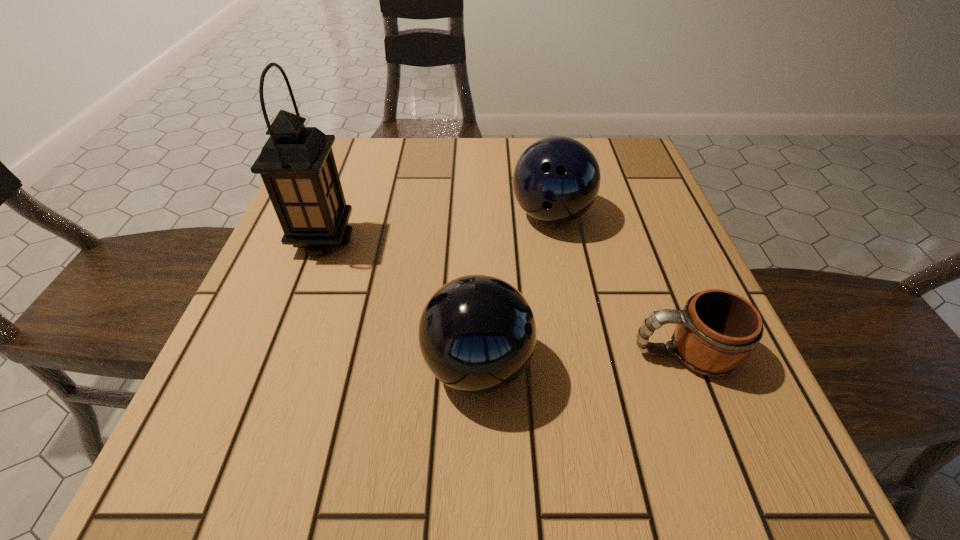
You are a GUI agent. You are given a task and a screenshot of the screen. Output one action in this format:
    pyautogui.click(x=<x>, y=<y>)
    Task: Click on the free location at the right edge of the desktop
    
    Given the screenshot: What is the action you would take?
    pyautogui.click(x=595, y=221)

Find the location of a particular element. This screenshot has width=960, height=540. vacant space at the far left corner of the desktop is located at coordinates (371, 150).

In the image, there is a desktop. At what (x,y) coordinates should I click in order to perform the action: click on free region at the near left corner. Please return your answer as a coordinate pair (x, y). The width and height of the screenshot is (960, 540). Looking at the image, I should click on (218, 456).

You are a GUI agent. You are given a task and a screenshot of the screen. Output one action in this format:
    pyautogui.click(x=<x>, y=<y>)
    Task: Click on the free space at the far right corner
    
    Given the screenshot: What is the action you would take?
    pyautogui.click(x=620, y=181)

The width and height of the screenshot is (960, 540). What are the coordinates of `free space at the near right corner of the desktop` in the screenshot? It's located at (715, 440).

Where is `free space between the tallest object and the farther bowling ball`? Image resolution: width=960 pixels, height=540 pixels. free space between the tallest object and the farther bowling ball is located at coordinates (437, 227).

Identify the location of unoccupied area between the mug and the nearer bowling ball. (581, 360).

Where is `vacant area between the shortest object and the farther bowling ball`? vacant area between the shortest object and the farther bowling ball is located at coordinates (617, 284).

Where is `free spot between the nearer bowling ball and the lantern`? This screenshot has width=960, height=540. free spot between the nearer bowling ball and the lantern is located at coordinates (400, 303).

Find the location of a particular element. free spot between the farther bowling ball and the lantern is located at coordinates (437, 227).